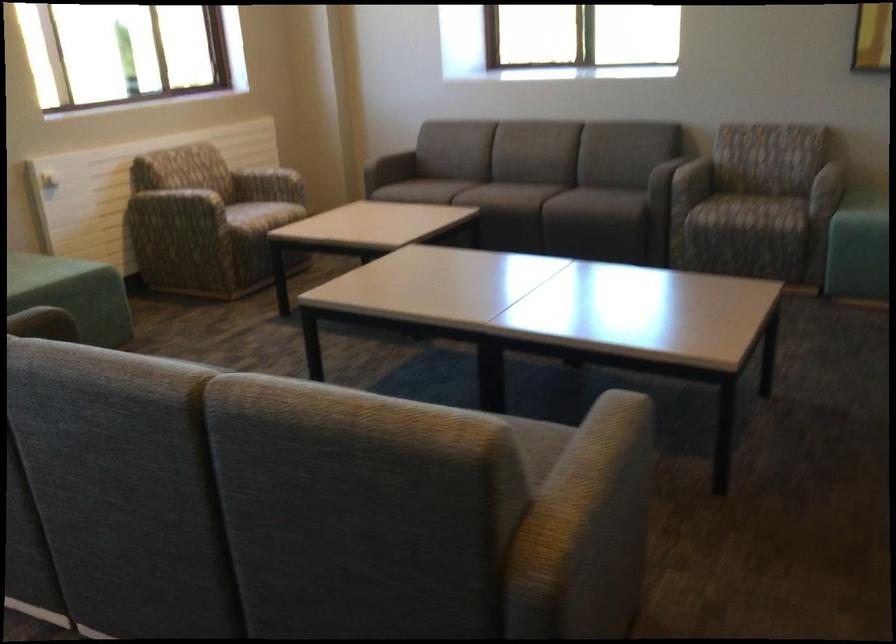
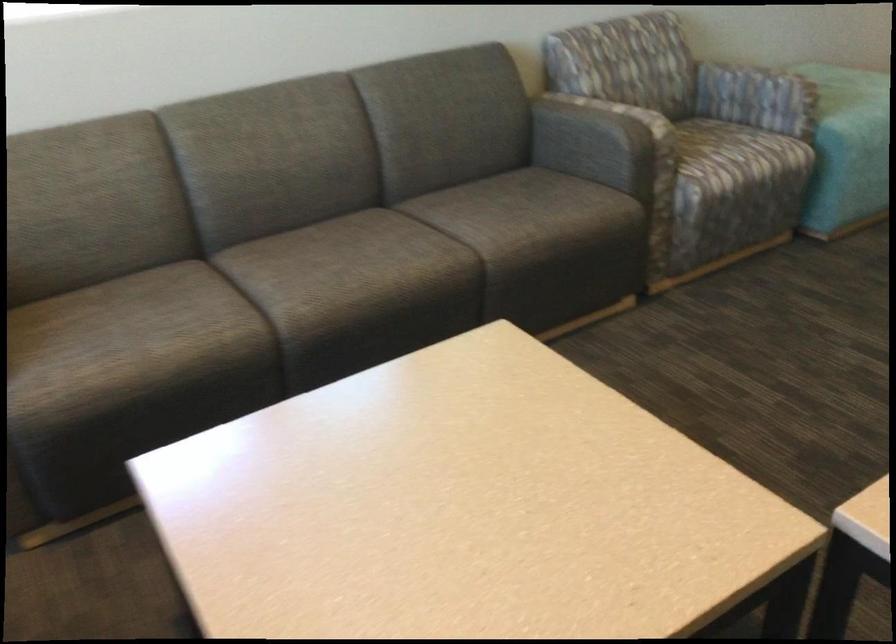
Where in the second image is the point corresponding to pixel 717 204 from the first image?

(737, 155)